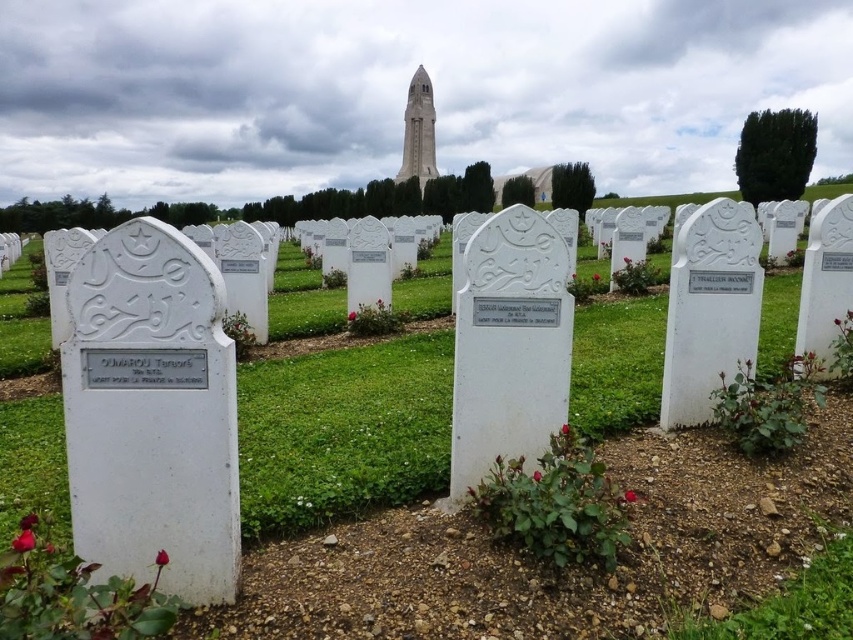
You are standing in front of the white marble tombstones at center and the white marble tower at center in the cemetery. Which one is taller?

The white marble tombstones at center are taller than the white marble tower at center.

You are standing at the entrance of the cemetery and want to find the white marble tombstones at center. According to the coordinates provided, where should you look to locate them?

The white marble tombstones at center are located at coordinates point (541, 572), so you should look towards the center area of the cemetery to find them.